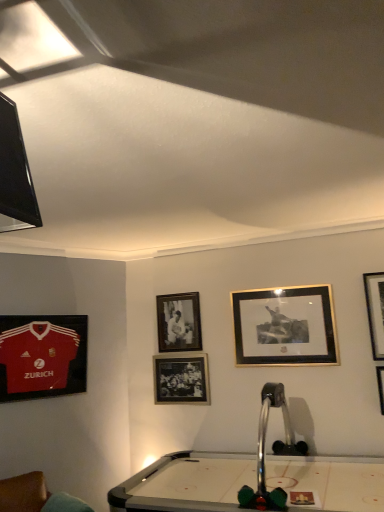
What do you see at coordinates (375, 311) in the screenshot? The height and width of the screenshot is (512, 384). I see `gold-framed picture at upper right, which is the 5th picture frame from left to right` at bounding box center [375, 311].

The height and width of the screenshot is (512, 384). What do you see at coordinates (181, 379) in the screenshot?
I see `matte black picture frame at center, the third picture frame in the left-to-right sequence` at bounding box center [181, 379].

Locate an element on the screen. matte black picture frame at center, the third picture frame in the left-to-right sequence is located at coordinates (181, 379).

This screenshot has height=512, width=384. I want to click on black matte picture frame at center, which is the fourth picture frame from right to left, so (x=179, y=322).

Consider the image. Between metallic silver billiard table at center and matte black picture frame at center, which is the 3th picture frame from right to left, which one has smaller size?

matte black picture frame at center, which is the 3th picture frame from right to left.

How different are the orientations of metallic silver billiard table at center and matte black picture frame at center, the third picture frame in the left-to-right sequence, in degrees?

0.371 degrees separate the facing orientations of metallic silver billiard table at center and matte black picture frame at center, the third picture frame in the left-to-right sequence.

The image size is (384, 512). What are the coordinates of `billiard table located underneath the matte black picture frame at center, the third picture frame in the left-to-right sequence (from a real-world perspective)` in the screenshot? It's located at (252, 477).

Which is farther from the camera, [139,484] or [178,400]?

The point [178,400] is behind.

From the image's perspective, is matte jersey at left, positioned as the first picture frame in left-to-right order, beneath gold-framed picture at upper right, which is the 5th picture frame from left to right?

Yes, from the image's perspective, matte jersey at left, positioned as the first picture frame in left-to-right order, is beneath gold-framed picture at upper right, which is the 5th picture frame from left to right.

Considering the sizes of objects matte jersey at left, the fifth picture frame viewed from the right, and gold-framed picture at upper right, which is counted as the first picture frame, starting from the right, in the image provided, who is wider, matte jersey at left, the fifth picture frame viewed from the right, or gold-framed picture at upper right, which is counted as the first picture frame, starting from the right,?

With larger width is matte jersey at left, the fifth picture frame viewed from the right.

Does matte jersey at left, the fifth picture frame viewed from the right, turn towards gold-framed picture at upper right, which is the 5th picture frame from left to right?

No, matte jersey at left, the fifth picture frame viewed from the right, is not facing towards gold-framed picture at upper right, which is the 5th picture frame from left to right.

Choose the correct answer: Is matte jersey at left, the fifth picture frame viewed from the right, inside gold-framed picture at upper right, which is counted as the first picture frame, starting from the right, or outside it?

matte jersey at left, the fifth picture frame viewed from the right, is located beyond the bounds of gold-framed picture at upper right, which is counted as the first picture frame, starting from the right.

In terms of height, does matte black picture frame at center, the third picture frame in the left-to-right sequence, look taller or shorter compared to metallic silver billiard table at center?

matte black picture frame at center, the third picture frame in the left-to-right sequence, is shorter than metallic silver billiard table at center.

The width and height of the screenshot is (384, 512). Find the location of `the 1st picture frame directly above the metallic silver billiard table at center (from a real-world perspective)`. the 1st picture frame directly above the metallic silver billiard table at center (from a real-world perspective) is located at coordinates (181, 379).

Is matte black picture frame at center, the third picture frame in the left-to-right sequence, far from metallic silver billiard table at center?

matte black picture frame at center, the third picture frame in the left-to-right sequence, is actually quite close to metallic silver billiard table at center.

Who is more distant, matte black picture frame at center, the third picture frame in the left-to-right sequence, or metallic silver billiard table at center?

Positioned behind is matte black picture frame at center, the third picture frame in the left-to-right sequence.

From a real-world perspective, who is located lower, black matte picture frame at center, positioned as the 2th picture frame in left-to-right order, or gold/black picture frame at upper center, the second picture frame viewed from the right?

In real-world perspective, gold/black picture frame at upper center, the second picture frame viewed from the right, is lower.

Is point (161, 298) farther from viewer compared to point (319, 345)?

That is True.

Who is more distant, black matte picture frame at center, positioned as the 2th picture frame in left-to-right order, or gold/black picture frame at upper center, which is the 4th picture frame from left to right?

black matte picture frame at center, positioned as the 2th picture frame in left-to-right order, is further from the camera.

Is black matte picture frame at center, which is the fourth picture frame from right to left, positioned far away from gold/black picture frame at upper center, the second picture frame viewed from the right?

No.

Is gold-framed picture at upper right, which is the 5th picture frame from left to right, facing away from gold/black picture frame at upper center, the second picture frame viewed from the right?

No, gold-framed picture at upper right, which is the 5th picture frame from left to right, is not facing away from gold/black picture frame at upper center, the second picture frame viewed from the right.

Does point (382, 357) come in front of point (244, 324)?

That is True.

Is gold-framed picture at upper right, which is counted as the first picture frame, starting from the right, to the left of gold/black picture frame at upper center, which is the 4th picture frame from left to right, from the viewer's perspective?

In fact, gold-framed picture at upper right, which is counted as the first picture frame, starting from the right, is to the right of gold/black picture frame at upper center, which is the 4th picture frame from left to right.

Who is bigger, gold/black picture frame at upper center, which is the 4th picture frame from left to right, or black matte picture frame at center, positioned as the 2th picture frame in left-to-right order?

Bigger between the two is gold/black picture frame at upper center, which is the 4th picture frame from left to right.

Is gold/black picture frame at upper center, which is the 4th picture frame from left to right, wider or thinner than black matte picture frame at center, positioned as the 2th picture frame in left-to-right order?

Considering their sizes, gold/black picture frame at upper center, which is the 4th picture frame from left to right, looks slimmer than black matte picture frame at center, positioned as the 2th picture frame in left-to-right order.

Are gold/black picture frame at upper center, the second picture frame viewed from the right, and black matte picture frame at center, which is the fourth picture frame from right to left, located far from each other?

No, there isn't a large distance between gold/black picture frame at upper center, the second picture frame viewed from the right, and black matte picture frame at center, which is the fourth picture frame from right to left.

Could black matte picture frame at center, which is the fourth picture frame from right to left, be considered to be inside gold/black picture frame at upper center, the second picture frame viewed from the right?

Actually, black matte picture frame at center, which is the fourth picture frame from right to left, is outside gold/black picture frame at upper center, the second picture frame viewed from the right.

Considering the positions of objects black matte picture frame at center, positioned as the 2th picture frame in left-to-right order, and matte jersey at left, the fifth picture frame viewed from the right, in the image provided, who is in front, black matte picture frame at center, positioned as the 2th picture frame in left-to-right order, or matte jersey at left, the fifth picture frame viewed from the right,?

Positioned in front is matte jersey at left, the fifth picture frame viewed from the right.

How distant is black matte picture frame at center, positioned as the 2th picture frame in left-to-right order, from matte jersey at left, positioned as the first picture frame in left-to-right order?

A distance of 3.30 feet exists between black matte picture frame at center, positioned as the 2th picture frame in left-to-right order, and matte jersey at left, positioned as the first picture frame in left-to-right order.

Is black matte picture frame at center, which is the fourth picture frame from right to left, oriented away from matte jersey at left, the fifth picture frame viewed from the right?

No.

Does black matte picture frame at center, positioned as the 2th picture frame in left-to-right order, touch matte jersey at left, the fifth picture frame viewed from the right?

No, black matte picture frame at center, positioned as the 2th picture frame in left-to-right order, is not making contact with matte jersey at left, the fifth picture frame viewed from the right.

Find the location of a particular element. The image size is (384, 512). picture frame that is the 1st one when counting upward from the metallic silver billiard table at center (from the image's perspective) is located at coordinates (181, 379).

Find the location of `the 3rd picture frame positioned below the gold-framed picture at upper right, which is counted as the first picture frame, starting from the right (from the image's perspective)`. the 3rd picture frame positioned below the gold-framed picture at upper right, which is counted as the first picture frame, starting from the right (from the image's perspective) is located at coordinates (42, 356).

Estimate the real-world distances between objects in this image. Which object is further from metallic silver billiard table at center, black matte picture frame at center, positioned as the 2th picture frame in left-to-right order, or matte black picture frame at center, the third picture frame in the left-to-right sequence?

Among the two, black matte picture frame at center, positioned as the 2th picture frame in left-to-right order, is located further to metallic silver billiard table at center.

Estimate the real-world distances between objects in this image. Which object is further from matte jersey at left, positioned as the first picture frame in left-to-right order, metallic silver billiard table at center or gold-framed picture at upper right, which is the 5th picture frame from left to right?

gold-framed picture at upper right, which is the 5th picture frame from left to right, is positioned further to the anchor matte jersey at left, positioned as the first picture frame in left-to-right order.

Based on their spatial positions, is black matte picture frame at center, positioned as the 2th picture frame in left-to-right order, or gold/black picture frame at upper center, which is the 4th picture frame from left to right, further from metallic silver billiard table at center?

black matte picture frame at center, positioned as the 2th picture frame in left-to-right order, is further to metallic silver billiard table at center.

Looking at the image, which one is located closer to matte jersey at left, the fifth picture frame viewed from the right, gold-framed picture at upper right, which is the 5th picture frame from left to right, or metallic silver billiard table at center?

metallic silver billiard table at center is positioned closer to the anchor matte jersey at left, the fifth picture frame viewed from the right.

From the image, which object appears to be farther from black matte picture frame at center, positioned as the 2th picture frame in left-to-right order, matte black picture frame at center, the third picture frame in the left-to-right sequence, or gold/black picture frame at upper center, the second picture frame viewed from the right?

The object further to black matte picture frame at center, positioned as the 2th picture frame in left-to-right order, is gold/black picture frame at upper center, the second picture frame viewed from the right.

From the picture: Which object lies nearer to the anchor point matte jersey at left, positioned as the first picture frame in left-to-right order, gold-framed picture at upper right, which is the 5th picture frame from left to right, or gold/black picture frame at upper center, which is the 4th picture frame from left to right?

gold/black picture frame at upper center, which is the 4th picture frame from left to right, is positioned closer to the anchor matte jersey at left, positioned as the first picture frame in left-to-right order.

Which object lies further to the anchor point metallic silver billiard table at center, matte black picture frame at center, the third picture frame in the left-to-right sequence, or black matte picture frame at center, which is the fourth picture frame from right to left?

Among the two, black matte picture frame at center, which is the fourth picture frame from right to left, is located further to metallic silver billiard table at center.

Considering their positions, is matte black picture frame at center, which is the 3th picture frame from right to left, positioned closer to gold-framed picture at upper right, which is counted as the first picture frame, starting from the right, than metallic silver billiard table at center?

metallic silver billiard table at center is closer to gold-framed picture at upper right, which is counted as the first picture frame, starting from the right.

Locate an element on the screen. This screenshot has height=512, width=384. picture frame located between matte black picture frame at center, the third picture frame in the left-to-right sequence, and gold-framed picture at upper right, which is the 5th picture frame from left to right, in the left-right direction is located at coordinates (285, 326).

This screenshot has height=512, width=384. I want to click on billiard table between matte jersey at left, positioned as the first picture frame in left-to-right order, and gold/black picture frame at upper center, the second picture frame viewed from the right, from left to right, so click(x=252, y=477).

In order to click on billiard table situated between matte jersey at left, the fifth picture frame viewed from the right, and gold-framed picture at upper right, which is the 5th picture frame from left to right, from left to right in this screenshot , I will do `click(252, 477)`.

Where is `picture frame between matte jersey at left, positioned as the first picture frame in left-to-right order, and matte black picture frame at center, the third picture frame in the left-to-right sequence`? picture frame between matte jersey at left, positioned as the first picture frame in left-to-right order, and matte black picture frame at center, the third picture frame in the left-to-right sequence is located at coordinates (179, 322).